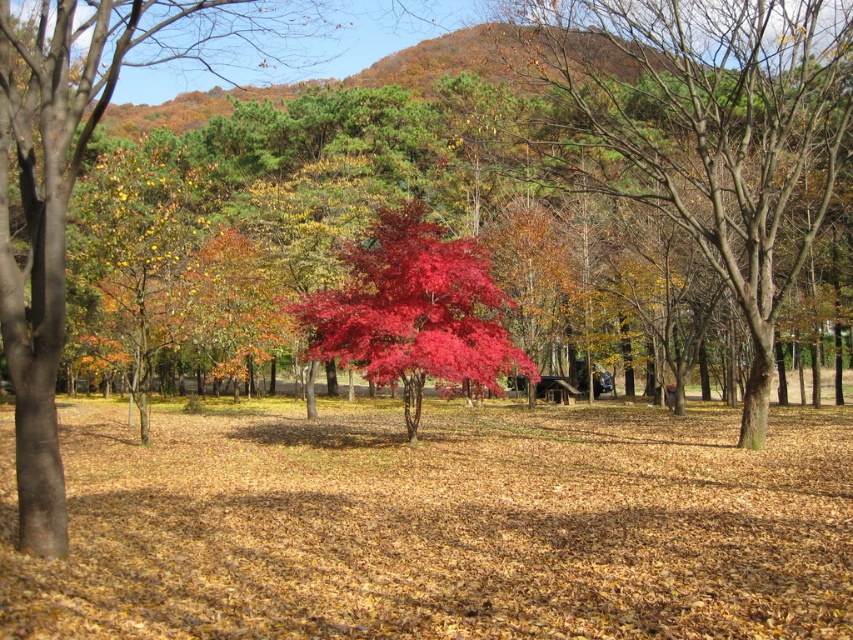
Which of these two, shiny red maple tree at center or vivid crimson leaves at center, stands shorter?

vivid crimson leaves at center

Is shiny red maple tree at center further to camera compared to vivid crimson leaves at center?

No, it is not.

The image size is (853, 640). I want to click on shiny red maple tree at center, so click(705, 129).

The image size is (853, 640). I want to click on shiny red maple tree at center, so click(705, 129).